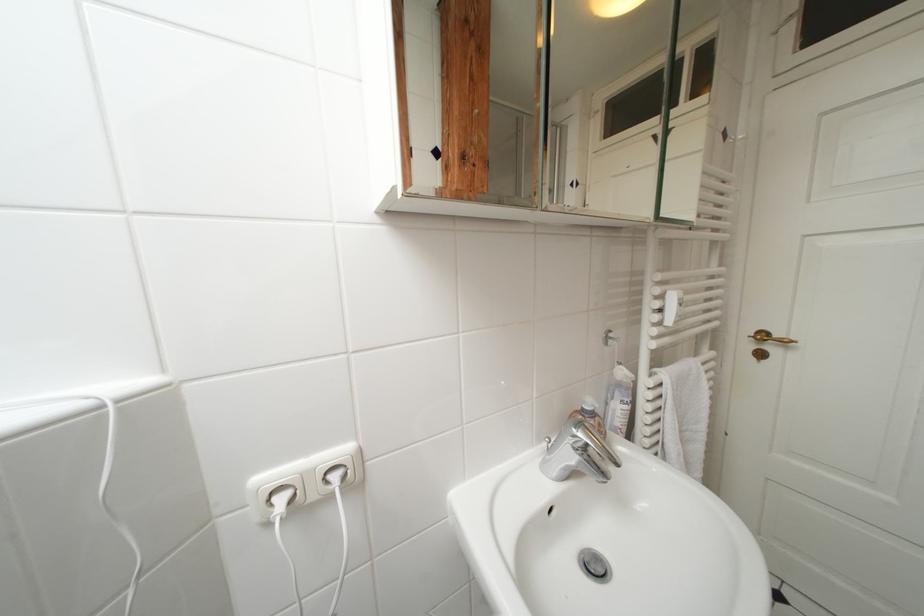
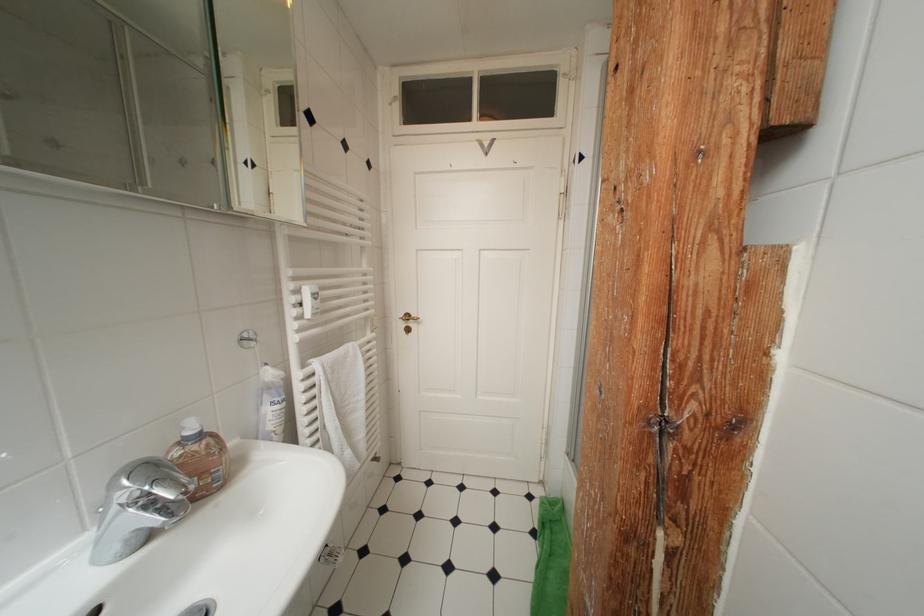
Question: The images are taken continuously from a first-person perspective. In which direction is your viewpoint rotating?

Choices:
 (A) Left
 (B) Right
 (C) Up
 (D) Down

Answer: (B)